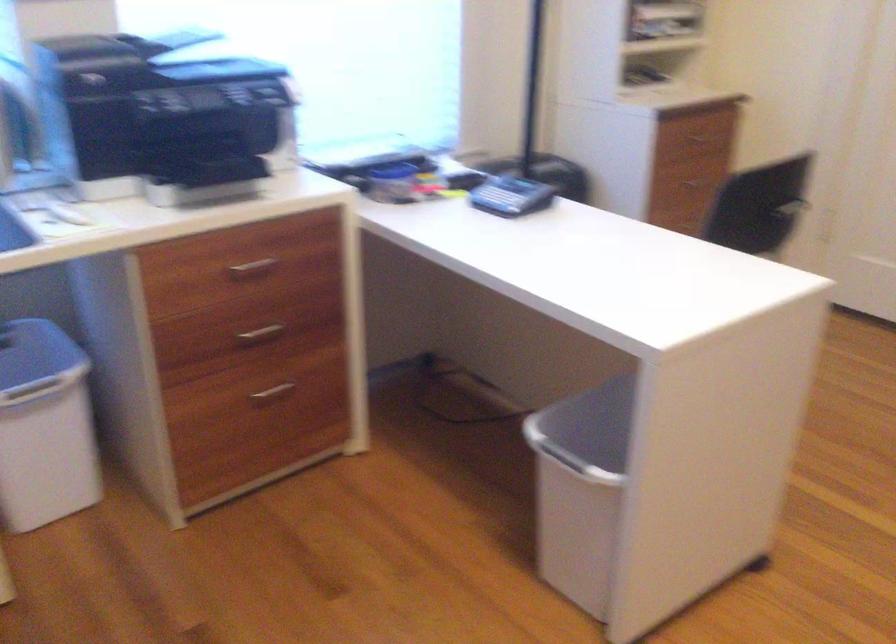
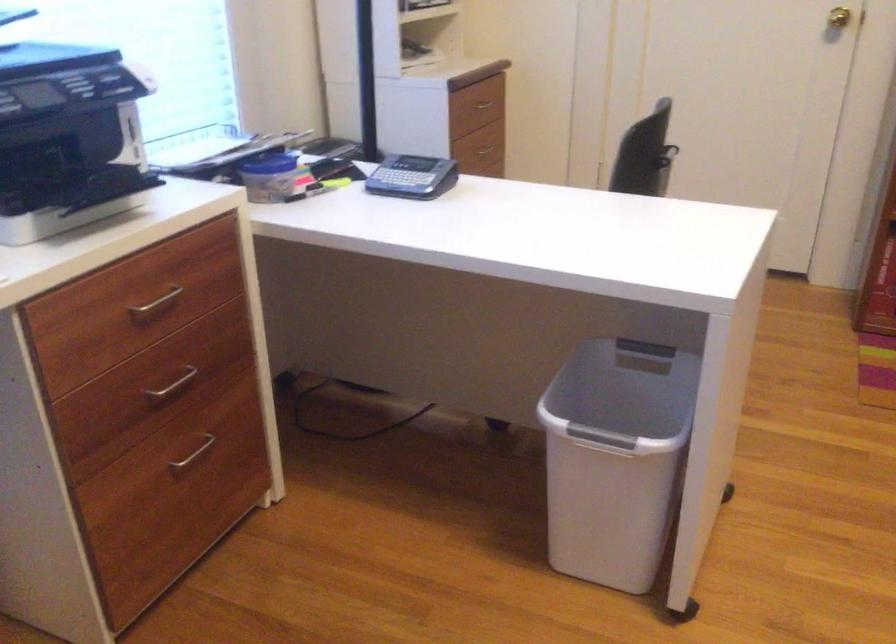
Which direction would the cameraman need to move to produce the second image?

The movement direction of the cameraman is left, forward.